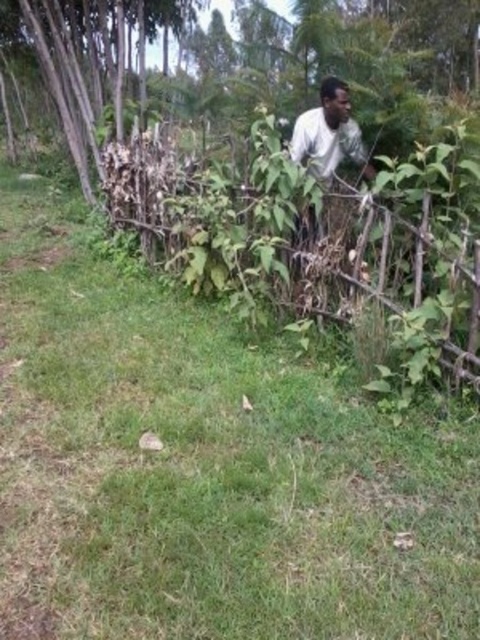
You are standing at the point marked by the coordinates point (90, 60) in the scene. What is the closest object to you?

The closest object to you at point (90, 60) is the brown dry wood at left, as the coordinates correspond directly to its location.